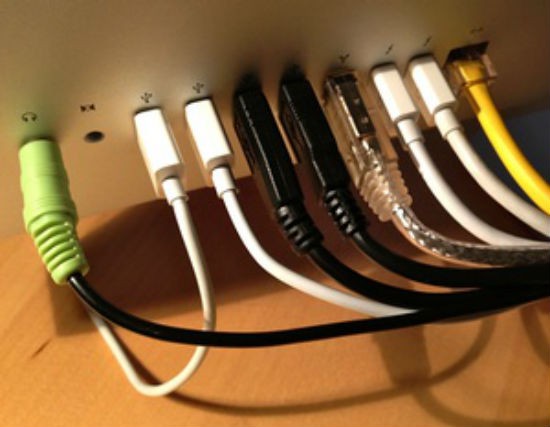
Find the location of a particular element. non-white cables is located at coordinates (48, 213), (268, 140), (308, 140), (361, 120), (483, 113).